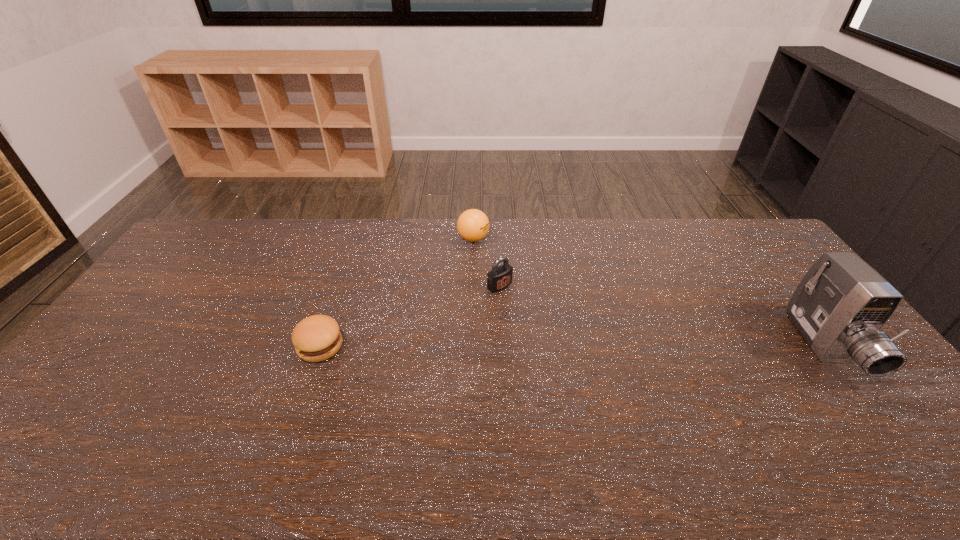
Where is `free spot at the far right corner of the desktop`? This screenshot has width=960, height=540. free spot at the far right corner of the desktop is located at coordinates (744, 245).

This screenshot has height=540, width=960. Identify the location of free spot between the hamburger and the third nearest object. (410, 316).

The image size is (960, 540). I want to click on vacant area that lies between the camcorder and the ping-pong ball, so click(649, 293).

This screenshot has height=540, width=960. Identify the location of blank region between the hamburger and the padlock. click(x=410, y=316).

At what (x,y) coordinates should I click in order to perform the action: click on free spot between the leftmost object and the ping-pong ball. Please return your answer as a coordinate pair (x, y). The height and width of the screenshot is (540, 960). Looking at the image, I should click on (396, 292).

The height and width of the screenshot is (540, 960). Find the location of `unoccupied area between the shortest object and the farthest object`. unoccupied area between the shortest object and the farthest object is located at coordinates (396, 292).

At what (x,y) coordinates should I click in order to perform the action: click on free spot between the rightmost object and the ping-pong ball. Please return your answer as a coordinate pair (x, y). Looking at the image, I should click on (649, 293).

Where is `vacant point located between the camcorder and the third nearest object`? The height and width of the screenshot is (540, 960). vacant point located between the camcorder and the third nearest object is located at coordinates (662, 316).

Find the location of `unoccupied position between the farthest object and the tallest object`. unoccupied position between the farthest object and the tallest object is located at coordinates (649, 293).

Image resolution: width=960 pixels, height=540 pixels. I want to click on blank region between the shortest object and the third nearest object, so click(410, 316).